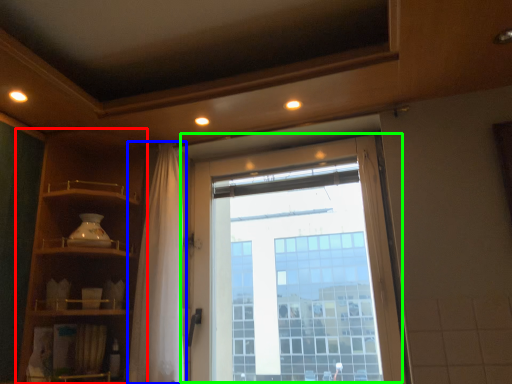
Question: Considering the real-world distances, which object is closest to shelf (highlighted by a red box)? shower curtain (highlighted by a blue box) or window (highlighted by a green box).

Choices:
 (A) shower curtain
 (B) window

Answer: (A)